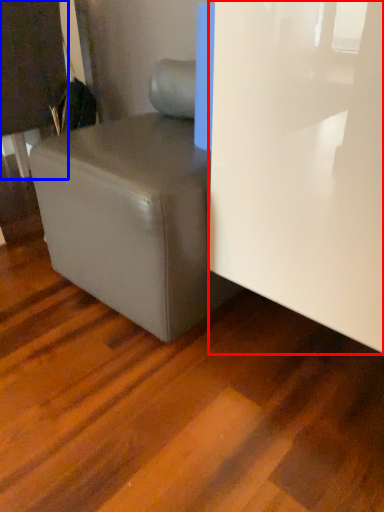
Question: Which object appears farthest to the camera in this image, glass door (highlighted by a red box) or furniture (highlighted by a blue box)?

Choices:
 (A) glass door
 (B) furniture

Answer: (B)